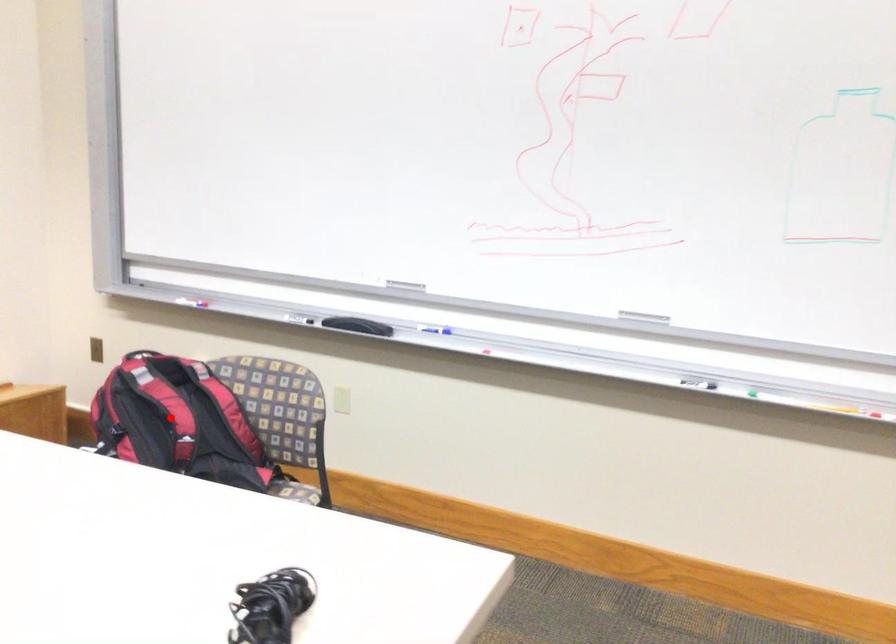
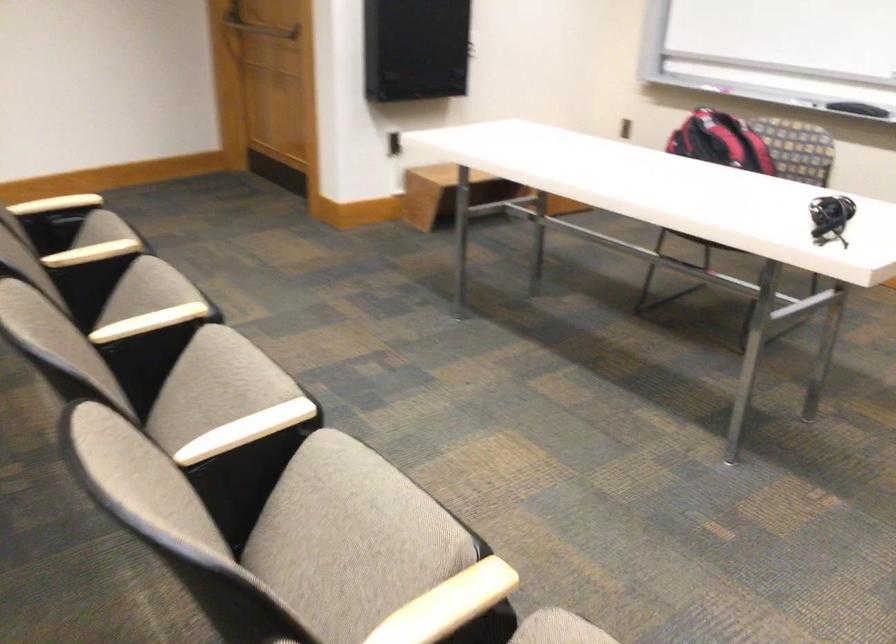
Question: I am providing you with two images of the same scene from different viewpoints. A red point is marked on the first image. Is the red point's position out of view in image 2?

Choices:
 (A) Yes
 (B) No

Answer: (B)